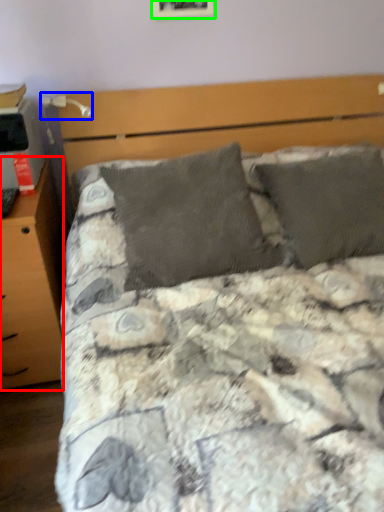
Question: Which is farther away from nightstand (highlighted by a red box)? table lamp (highlighted by a blue box) or picture frame (highlighted by a green box)?

Choices:
 (A) table lamp
 (B) picture frame

Answer: (B)